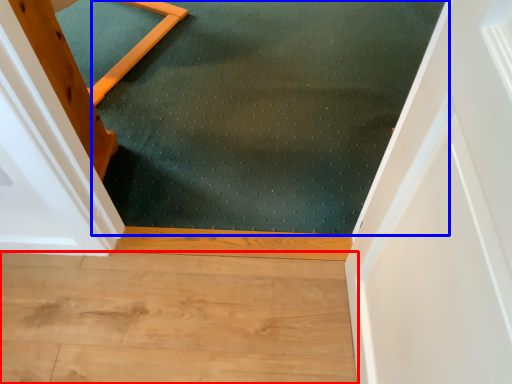
Question: Which point is closer to the camera, hardwood (highlighted by a red box) or mat (highlighted by a blue box)?

Choices:
 (A) hardwood
 (B) mat

Answer: (A)